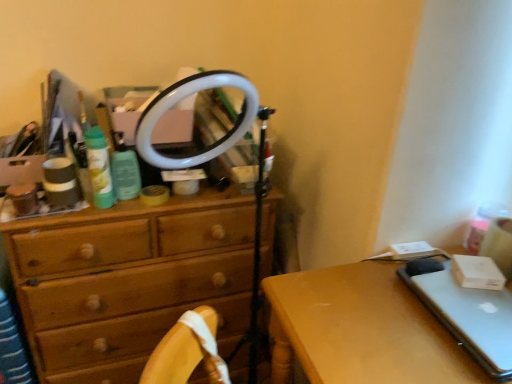
Question: From a real-world perspective, relative to wooden chest of drawers at center, is silver metallic laptop at right vertically above or below?

Choices:
 (A) above
 (B) below

Answer: (A)

Question: In terms of width, does silver metallic laptop at right look wider or thinner when compared to wooden chest of drawers at center?

Choices:
 (A) thin
 (B) wide

Answer: (A)

Question: Which of these objects is positioned closest to the silver metallic laptop at right?

Choices:
 (A) wooden chest of drawers at center
 (B) silver metallic desk at lower right
 (C) wooden drawer at center

Answer: (B)

Question: Considering the real-world distances, which object is closest to the wooden drawer at center?

Choices:
 (A) wooden chest of drawers at center
 (B) silver metallic laptop at right
 (C) silver metallic desk at lower right

Answer: (A)